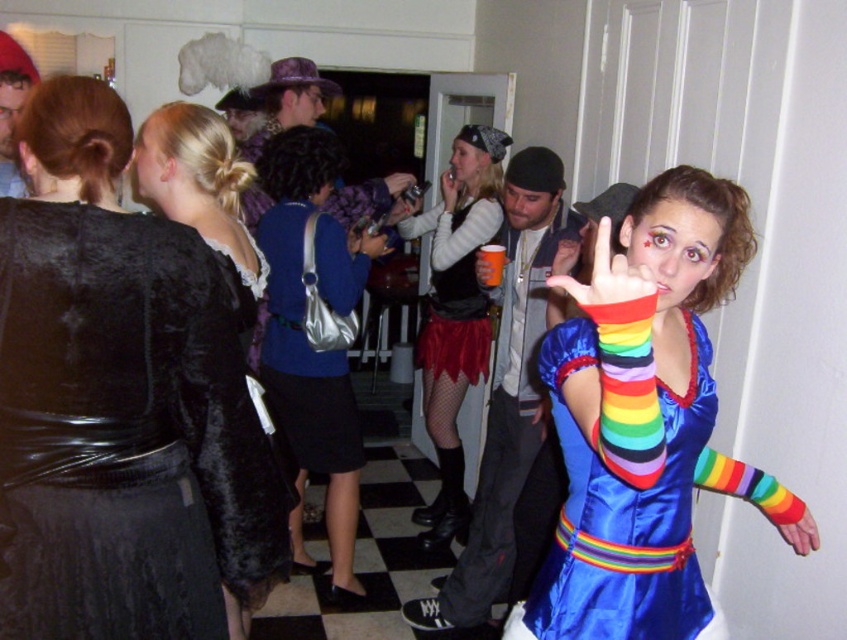
Question: Which object is farther from the camera taking this photo?

Choices:
 (A) shiny silver purse at center
 (B) red satin skirt at center
 (C) velvet black dress at upper left

Answer: (B)

Question: Which object is positioned closest to the matte gray jacket at center?

Choices:
 (A) red satin skirt at center
 (B) shiny silver purse at center
 (C) rainbow satin dress at center

Answer: (A)

Question: In this image, where is shiny silver purse at center located relative to matte gray jacket at center?

Choices:
 (A) above
 (B) below

Answer: (A)

Question: Which object appears closest to the camera in this image?

Choices:
 (A) red satin skirt at center
 (B) shiny silver purse at center

Answer: (B)

Question: Does velvet black dress at upper left appear over matte gray jacket at center?

Choices:
 (A) yes
 (B) no

Answer: (A)

Question: Is rainbow satin dress at center to the left of velvet red skirt at center from the viewer's perspective?

Choices:
 (A) no
 (B) yes

Answer: (A)